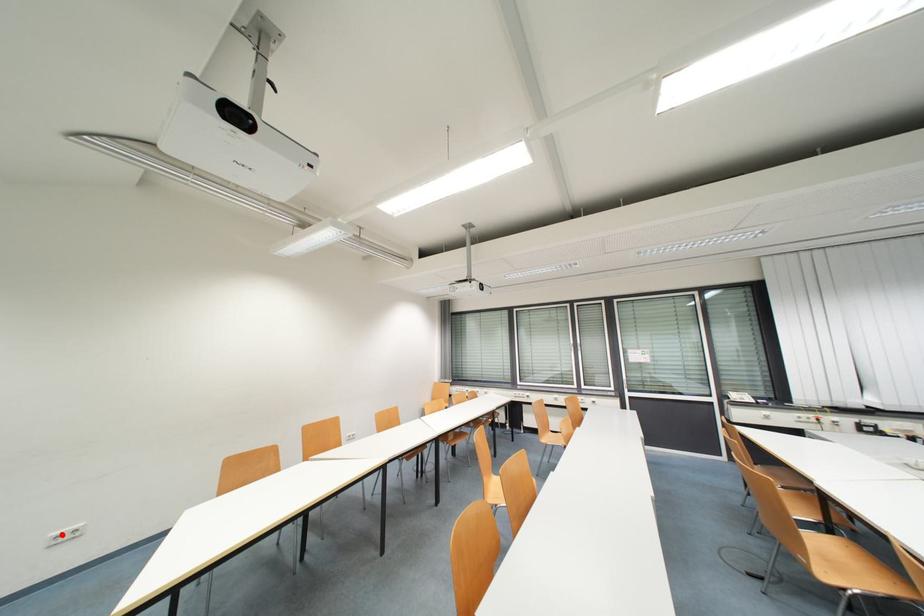
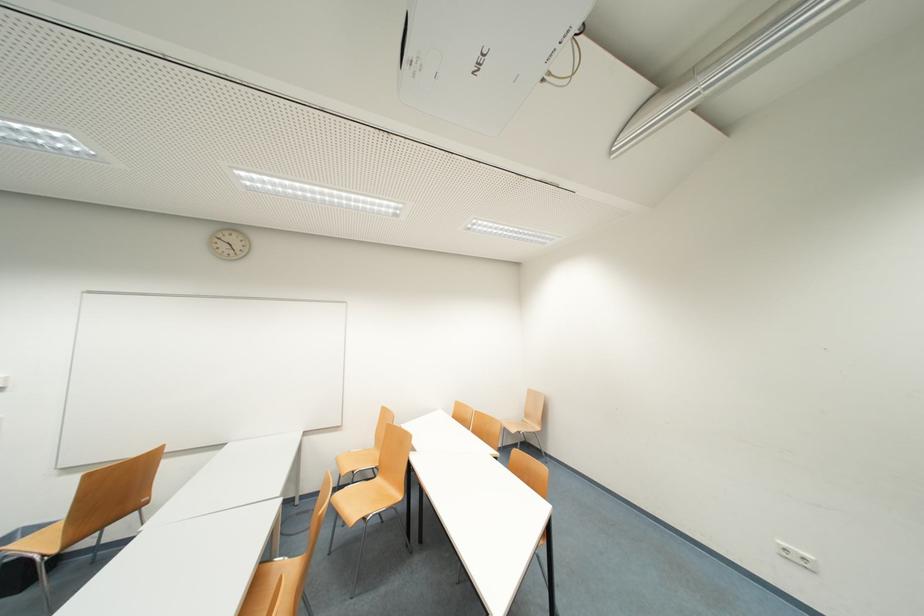
Question: I am providing you with two images of the same scene from different viewpoints. Given a red point in image1, look at the same physical point in image2. Is it:

Choices:
 (A) Closer to the viewpoint
 (B) Farther from the viewpoint

Answer: (A)